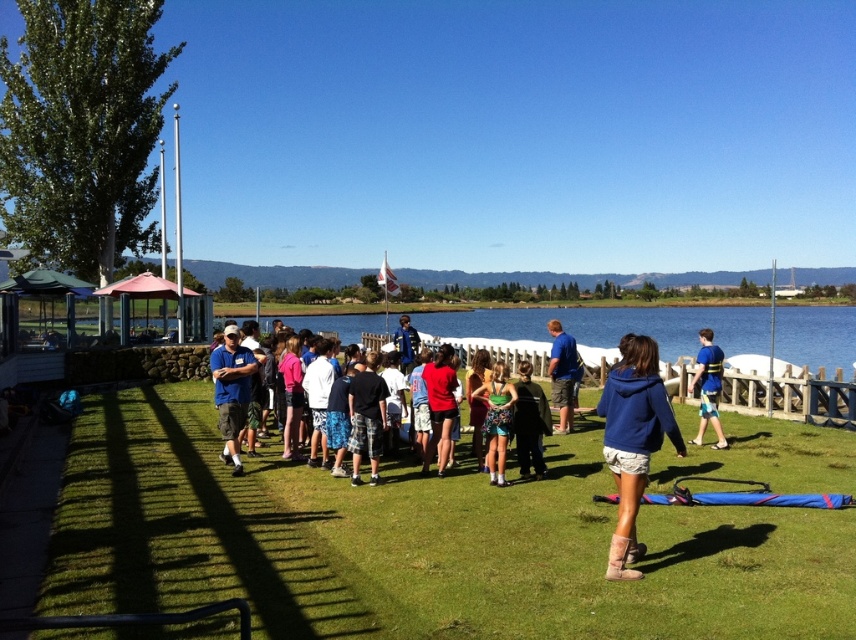
You are standing at the edge of the grassy area near the wooden fence and want to take a photo of both the point at coordinates (456, 408) and the point at (716, 445). Which point will appear larger in your camera view?

The point at coordinates (456, 408) will appear larger in the camera view because it is closer to the camera than the point at (716, 445).

You are organizing a photo shoot and need to ensure that the green jersey at center and the blue cotton shirt at center are visible in the frame. Considering their sizes, which clothing item might require you to adjust your camera angle to capture its full view?

The blue cotton shirt at center has a greater width than the green jersey at center, so it might require adjusting the camera angle to ensure its full view is captured.